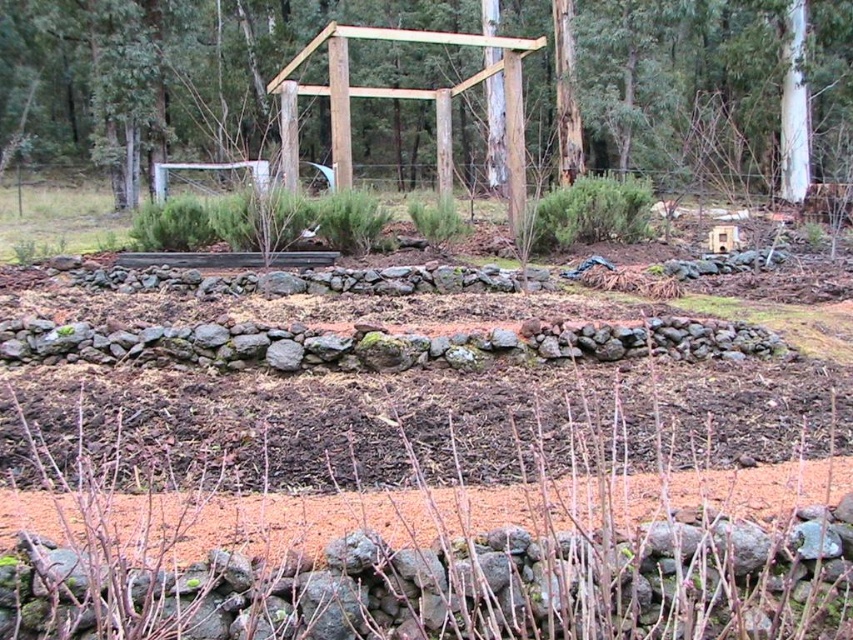
Between brown wooden structure at center and brown soil at center, which one appears on the left side from the viewer's perspective?

brown wooden structure at center

Is brown wooden structure at center thinner than brown soil at center?

No, brown wooden structure at center is not thinner than brown soil at center.

Measure the distance between point (712,60) and camera.

Point (712,60) is 45.72 feet away from camera.

Image resolution: width=853 pixels, height=640 pixels. In order to click on brown wooden structure at center in this screenshot , I will do `click(164, 70)`.